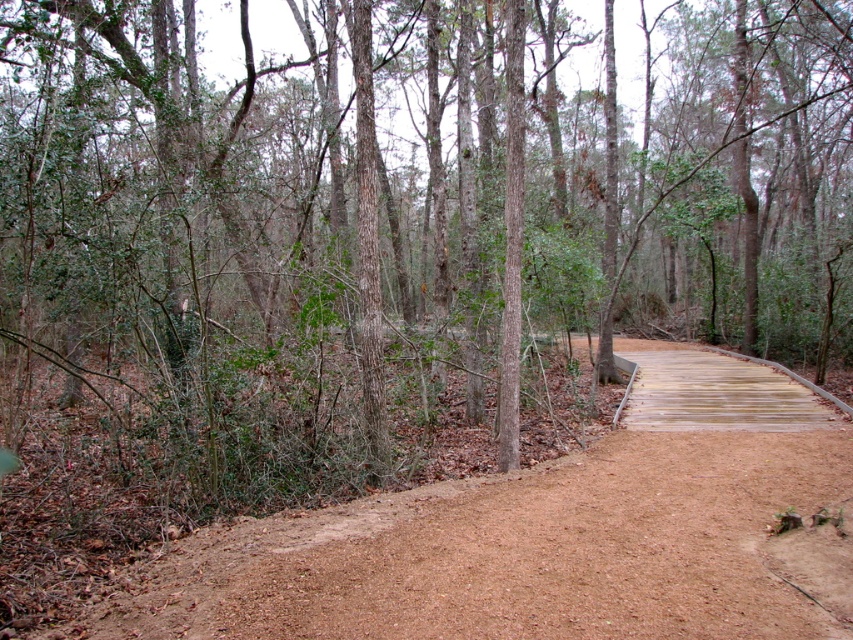
Question: Observing the image, what is the correct spatial positioning of brown dirt track at lower center in reference to wooden boardwalk at center-right?

Choices:
 (A) below
 (B) above

Answer: (A)

Question: Which object is farther from the camera taking this photo?

Choices:
 (A) brown dirt track at lower center
 (B) wooden boardwalk at center-right

Answer: (B)

Question: Is brown dirt track at lower center positioned in front of wooden boardwalk at center-right?

Choices:
 (A) no
 (B) yes

Answer: (B)

Question: Which object appears farthest from the camera in this image?

Choices:
 (A) brown dirt track at lower center
 (B) wooden boardwalk at center-right

Answer: (B)

Question: Is brown dirt track at lower center behind wooden boardwalk at center-right?

Choices:
 (A) yes
 (B) no

Answer: (B)